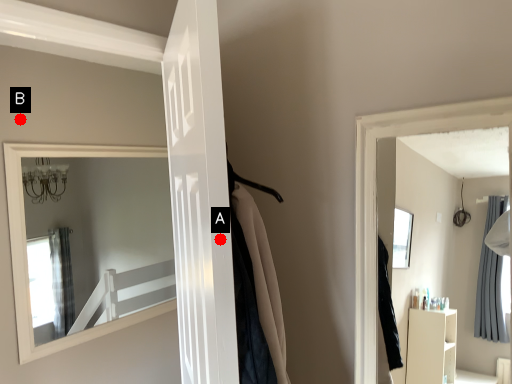
Question: Two points are circled on the image, labeled by A and B beside each circle. Which point is farther to the camera?

Choices:
 (A) A is further
 (B) B is further

Answer: (B)